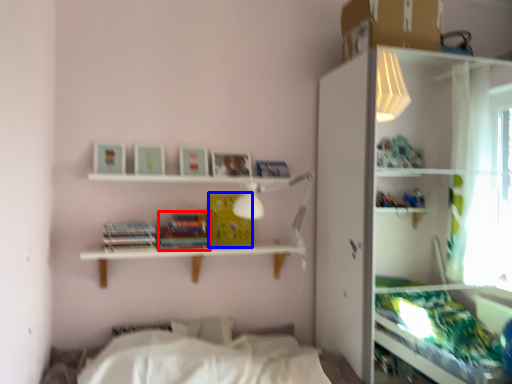
Question: Which of the following is the closest to the observer, paperback book (highlighted by a red box) or paperback book (highlighted by a blue box)?

Choices:
 (A) paperback book
 (B) paperback book

Answer: (A)